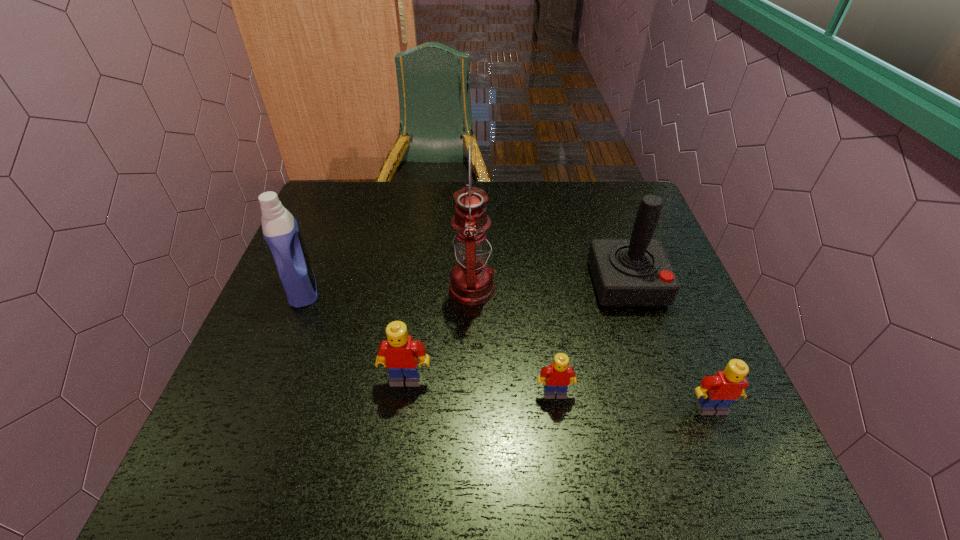
Locate an element on the screen. vacant space located 0.070m on the front-facing side of the shortest object is located at coordinates (560, 432).

At what (x,y) coordinates should I click in order to perform the action: click on blank space located on the left of the tallest object. Please return your answer as a coordinate pair (x, y). The width and height of the screenshot is (960, 540). Looking at the image, I should click on (366, 289).

This screenshot has width=960, height=540. I want to click on free space located 0.130m on the base of the joystick, so click(x=650, y=354).

I want to click on free space located 0.130m on the front of the leftmost object, so click(276, 353).

I want to click on object located in the left edge section of the desktop, so click(280, 229).

Find the location of a particular element. The height and width of the screenshot is (540, 960). Lego at the right edge is located at coordinates (715, 395).

This screenshot has height=540, width=960. In order to click on joystick at the right edge in this screenshot , I will do `click(626, 272)`.

I want to click on object that is positioned at the near right corner, so click(x=715, y=395).

In the image, there is a desktop. At what (x,y) coordinates should I click in order to perform the action: click on blank space at the far edge. Please return your answer as a coordinate pair (x, y). Looking at the image, I should click on (561, 184).

The width and height of the screenshot is (960, 540). In order to click on free space at the near edge of the desktop in this screenshot , I will do `click(348, 394)`.